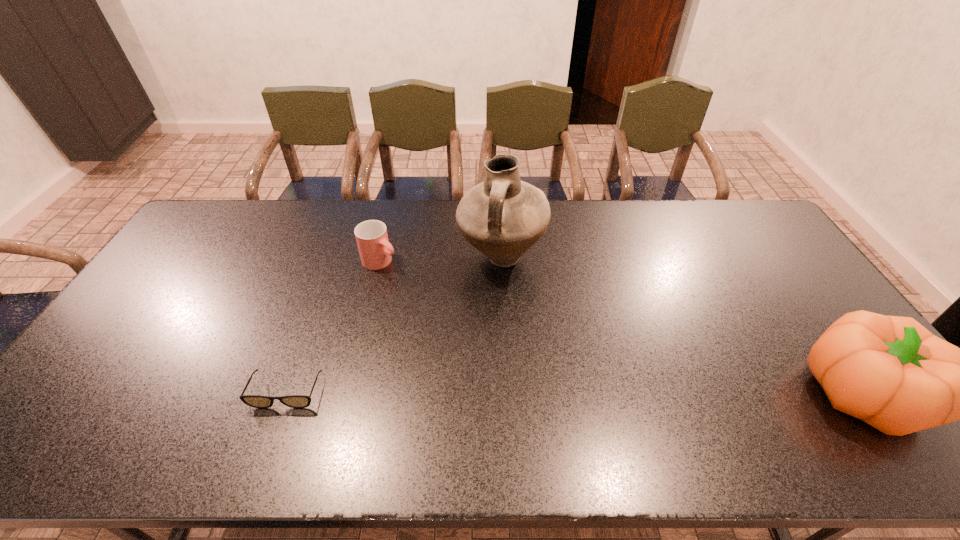
Identify the location of vacant region located 0.180m on the handle side of the second object from right to left. (514, 335).

At what (x,y) coordinates should I click in order to perform the action: click on vacant space situated on the handle side of the second object from right to left. Please return your answer as a coordinate pair (x, y). The height and width of the screenshot is (540, 960). Looking at the image, I should click on (520, 374).

This screenshot has width=960, height=540. Find the location of `object that is at the far edge`. object that is at the far edge is located at coordinates (502, 217).

Where is `object that is at the near edge`? object that is at the near edge is located at coordinates (256, 401).

Find the location of a particular element. vacant space at the far edge is located at coordinates (664, 206).

The image size is (960, 540). Identify the location of vacant space at the near edge. (680, 408).

In the image, there is a desktop. At what (x,y) coordinates should I click in order to perform the action: click on vacant space at the right edge. Please return your answer as a coordinate pair (x, y). The width and height of the screenshot is (960, 540). Looking at the image, I should click on 768,299.

Find the location of a particular element. The width and height of the screenshot is (960, 540). blank space at the far right corner of the desktop is located at coordinates (723, 225).

Where is `free area in between the sunglasses and the third object from left to right`? This screenshot has width=960, height=540. free area in between the sunglasses and the third object from left to right is located at coordinates (394, 325).

At what (x,y) coordinates should I click in order to perform the action: click on free spot between the pitcher and the leftmost object. Please return your answer as a coordinate pair (x, y). Image resolution: width=960 pixels, height=540 pixels. Looking at the image, I should click on (394, 325).